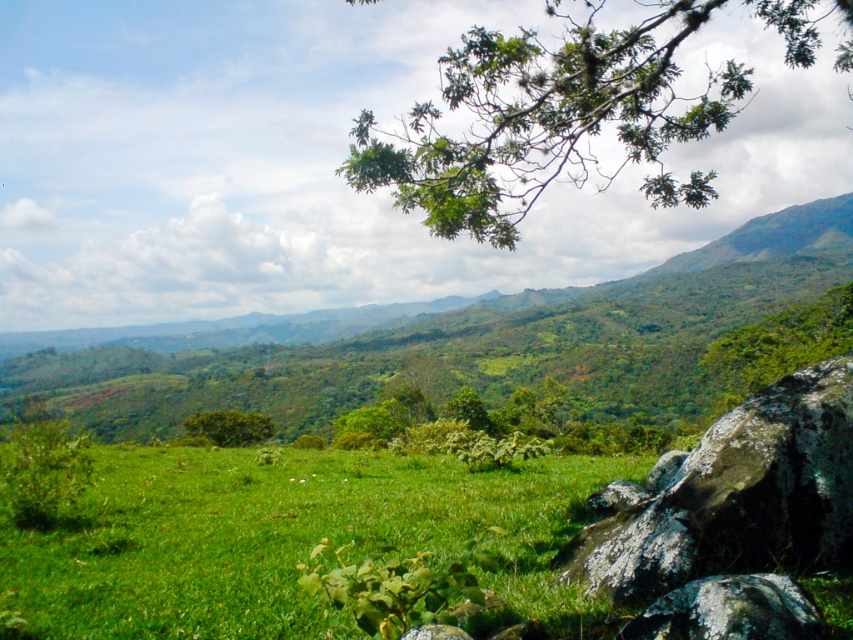
You are standing in the grassy field and see the green leafy bush at lower left and the green leafy bush at center. Which bush is closer to you?

The green leafy bush at lower left is closer to you because it is positioned over the green leafy bush at center, indicating it is in front.

You are standing in the scene and want to walk from the point at coordinates point [798,513] to the point at coordinates point [241,433]. Which direction should you move to get closer to your destination?

You should move towards the lower left direction because point [798,513] is closer to the camera than point [241,433], so moving towards the lower left will take you towards the destination.

You are standing at the center of the image and see the green leafy bush at lower left and the green leafy bush at center. Which one is positioned to the right of the other?

The green leafy bush at lower left is to the right of green leafy bush at center.